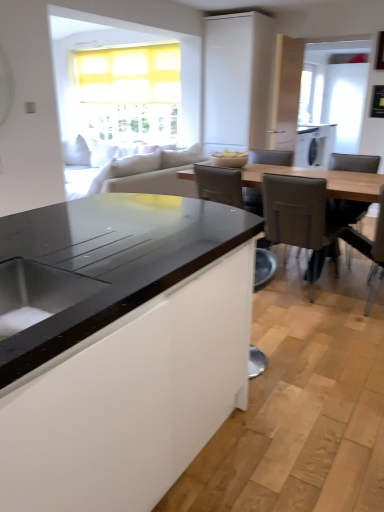
Question: Is metallic gray chair at lower center, which is the 4th chair in right-to-left order, spatially inside leatherette chair at right, which ranks as the 3th chair in right-to-left order, or outside of it?

Choices:
 (A) inside
 (B) outside

Answer: (B)

Question: Based on their sizes in the image, would you say metallic gray chair at lower center, positioned as the 1th chair in left-to-right order, is bigger or smaller than leatherette chair at right, which ranks as the 3th chair in right-to-left order?

Choices:
 (A) small
 (B) big

Answer: (A)

Question: Estimate the real-world distances between objects in this image. Which object is farther from the leatherette chair at right, the first chair from the right?

Choices:
 (A) brown leather chair at right, positioned as the 2th chair in right-to-left order
 (B) leatherette chair at right, which ranks as the 3th chair in right-to-left order
 (C) white matte cabinet at upper center
 (D) matte white bowl at center
 (E) metallic gray chair at lower center, positioned as the 1th chair in left-to-right order

Answer: (C)

Question: Which of these objects is positioned farthest from the white matte cabinet at upper center?

Choices:
 (A) wooden table at center
 (B) leatherette chair at right, acting as the second chair starting from the left
 (C) leather-like gray armchair at center
 (D) brown leather chair at right, which is the third chair from left to right
 (E) matte white bowl at center

Answer: (D)